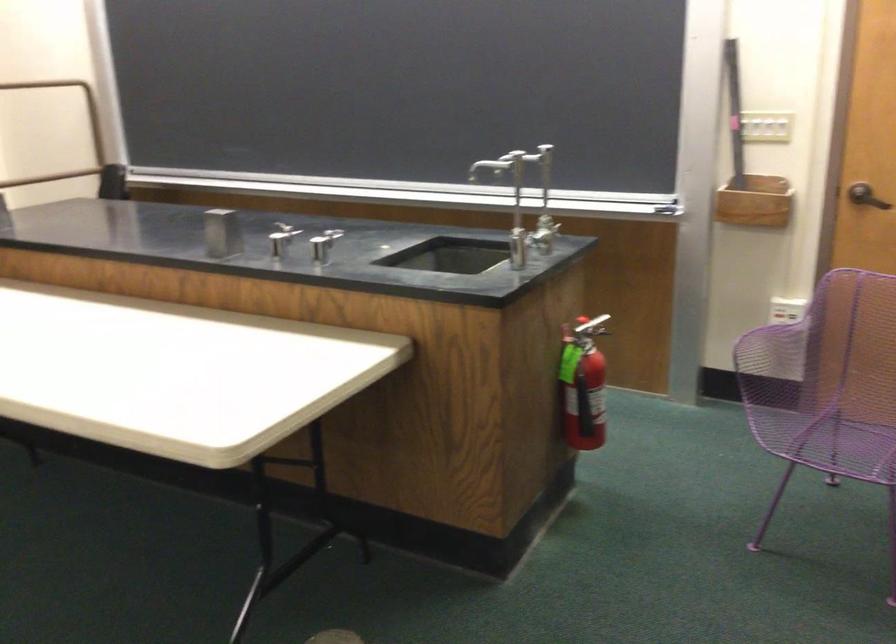
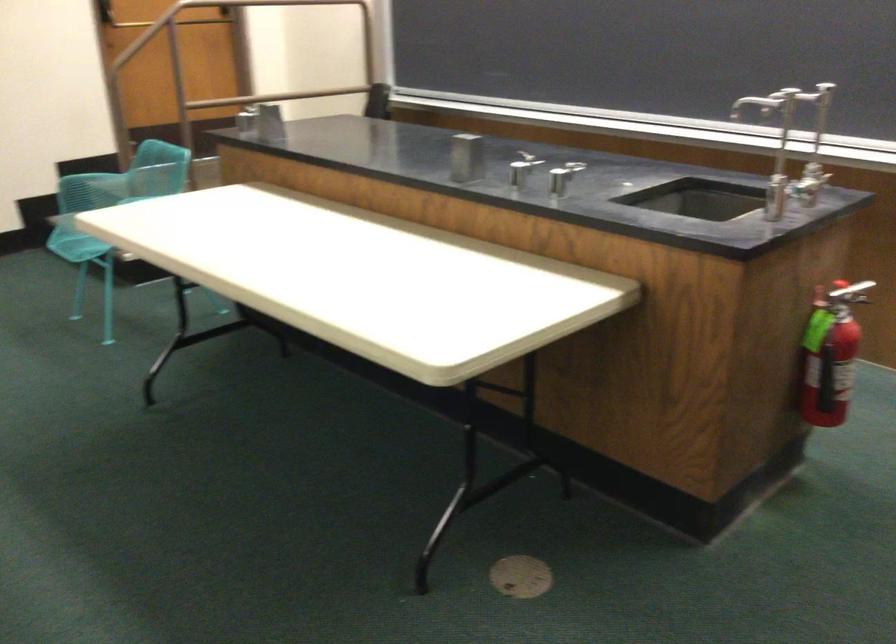
Question: How did the camera likely rotate?

Choices:
 (A) Left
 (B) Right
 (C) Up
 (D) Down

Answer: (A)